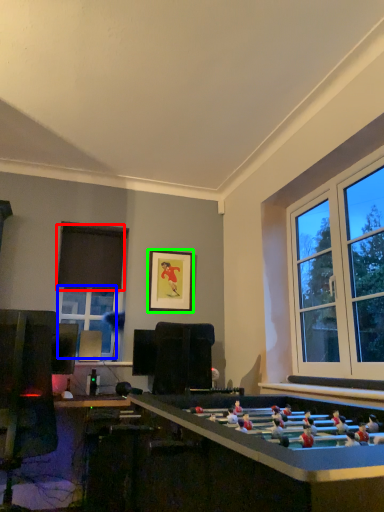
Question: Considering the real-world distances, which object is closest to curtain (highlighted by a red box)? window (highlighted by a blue box) or picture frame (highlighted by a green box).

Choices:
 (A) window
 (B) picture frame

Answer: (A)